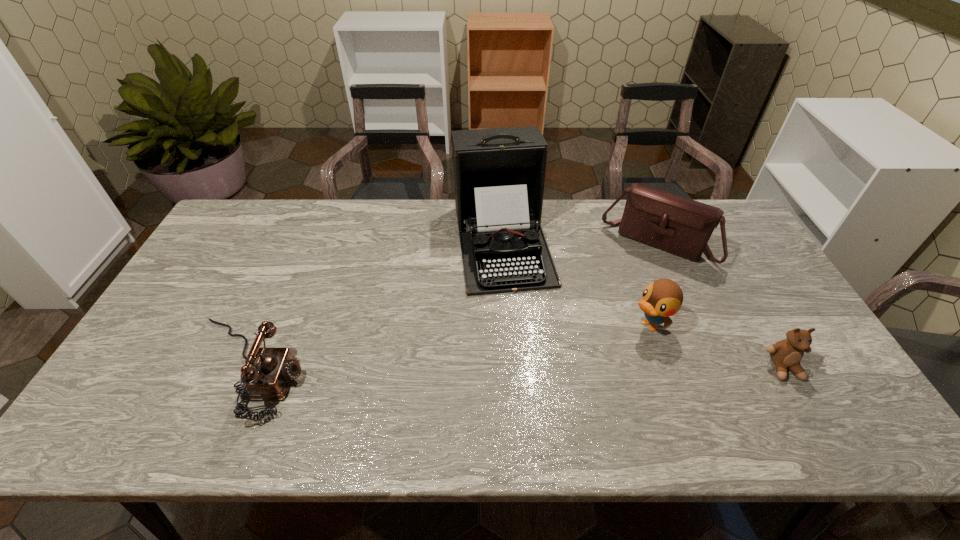
Locate an element on the screen. vacant space that is in between the second tallest object and the teddy bear is located at coordinates (720, 306).

Find the location of a particular element. This screenshot has height=540, width=960. vacant region between the fourth shortest object and the teddy bear is located at coordinates (720, 306).

Image resolution: width=960 pixels, height=540 pixels. What are the coordinates of `free space between the telephone and the duck` in the screenshot? It's located at click(446, 347).

This screenshot has width=960, height=540. Identify the location of unoccupied area between the leftmost object and the shoulder bag. (451, 306).

Where is `free spot between the telephone and the teddy bear`? The height and width of the screenshot is (540, 960). free spot between the telephone and the teddy bear is located at coordinates (515, 368).

Identify which object is located as the fourth nearest to the teddy bear. Please provide its 2D coordinates. Your answer should be formatted as a tuple, i.e. [(x, y)], where the tuple contains the x and y coordinates of a point satisfying the conditions above.

[(268, 378)]

Select which object appears as the second closest to the duck. Please provide its 2D coordinates. Your answer should be formatted as a tuple, i.e. [(x, y)], where the tuple contains the x and y coordinates of a point satisfying the conditions above.

[(499, 174)]